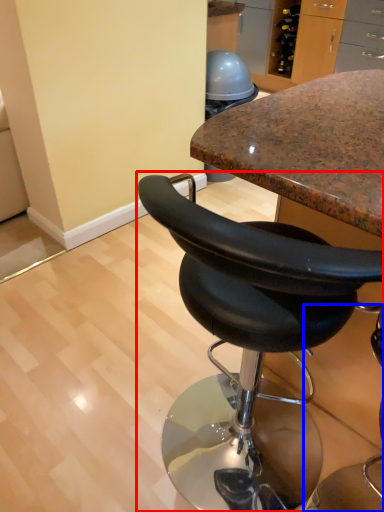
Question: Which point is closer to the camera, chair (highlighted by a red box) or chair (highlighted by a blue box)?

Choices:
 (A) chair
 (B) chair

Answer: (B)